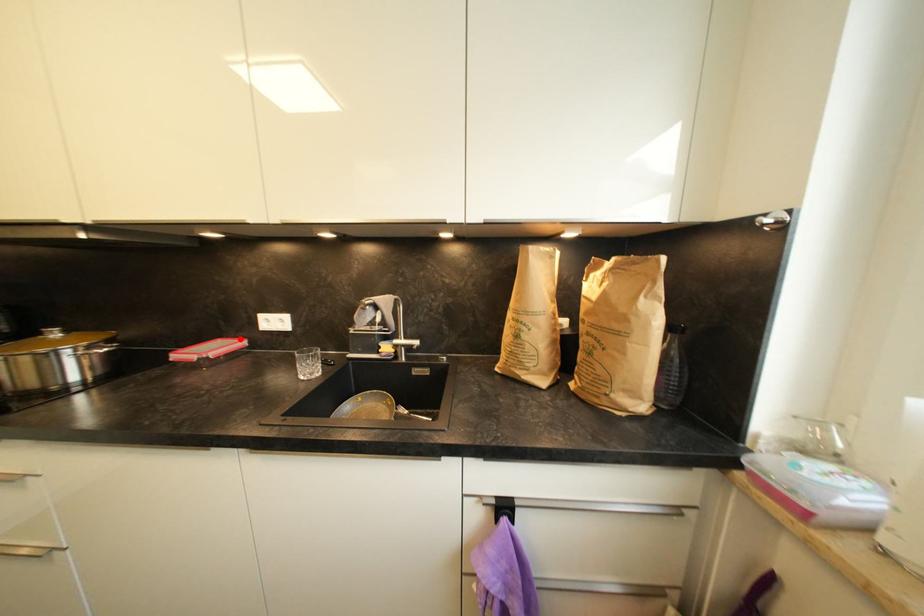
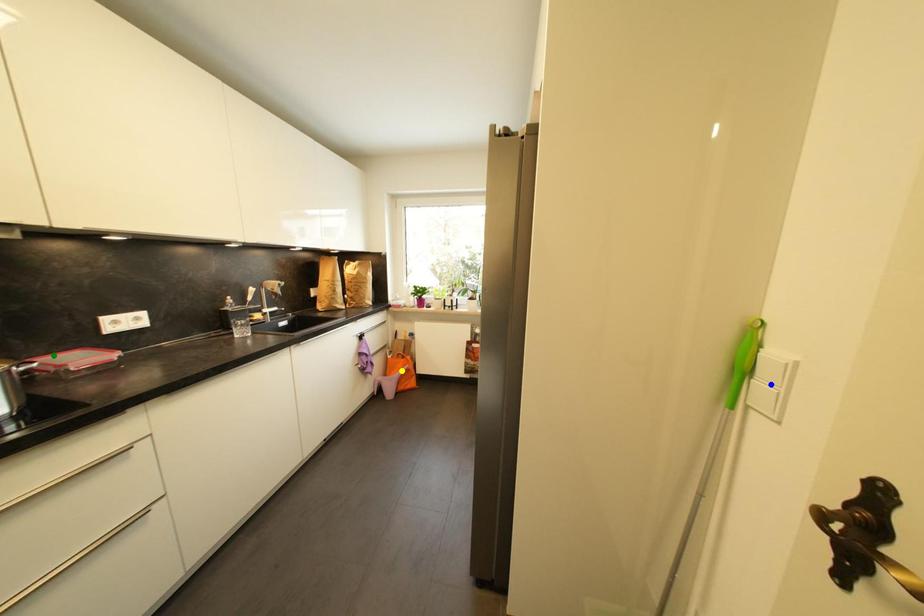
Question: I am providing you with two images of the same scene from different viewpoints. A red point is marked on the first image. You are given multiple points on the second image. In image 2, which mark is for the same physical point as the one in image 1?

Choices:
 (A) green point
 (B) blue point
 (C) yellow point

Answer: (A)